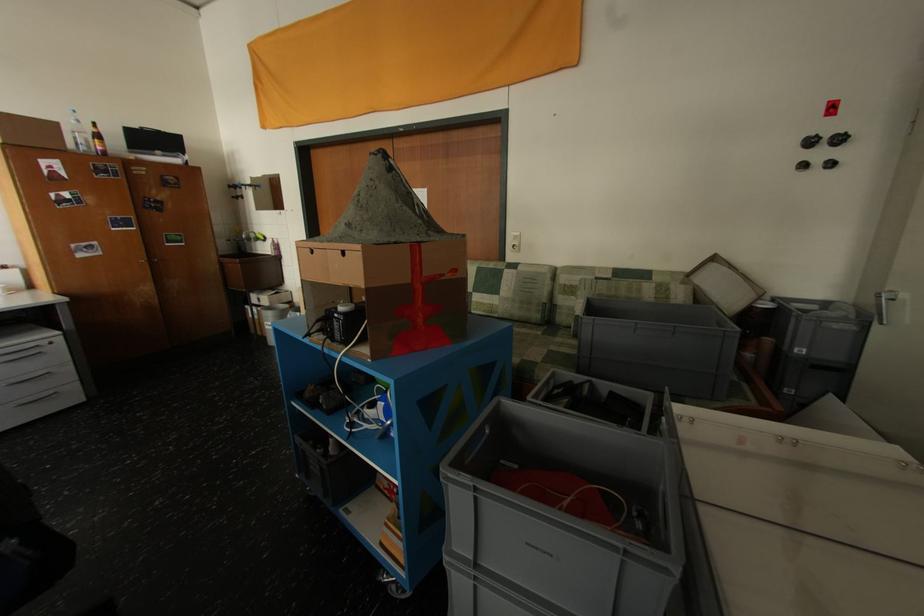
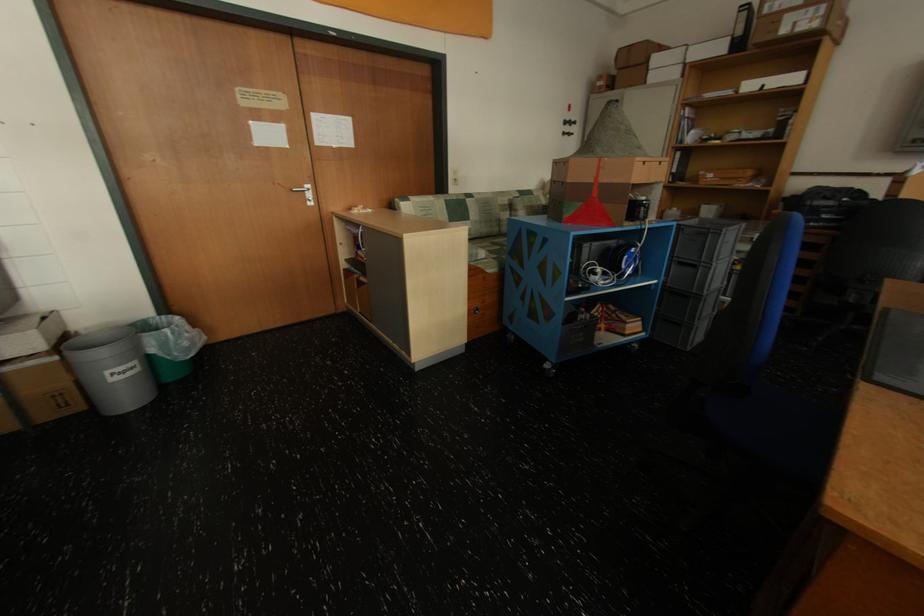
In the second image, find the point that corresponds to pixel 812 167 in the first image.

(573, 135)